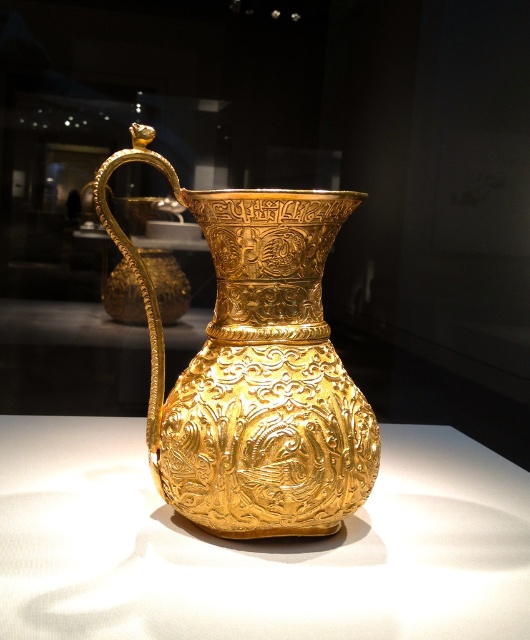
Looking at this image, you are a museum visitor standing in front of the polished gold vase at center. The museum requires visitors to maintain a minimum distance of 30 inches from all artifacts for preservation purposes. Are you currently violating this rule?

The polished gold vase at center and viewer are 27.43 inches apart from each other, which is less than the required 30 inches. Therefore, you are violating the museum rule and should step back to maintain the appropriate distance.

From the picture: You are a photographer trying to capture the golden pitcher in the museum. You notice two points on the pitcher labeled as point (46, 632) and point (267, 426). Which point would appear larger in your photo?

Point (46, 632) is closer to the camera than point (267, 426), so it would appear larger in the photo.

You are a security guard in the museum and need to locate the polished gold vase at center. According to the coordinates provided, where should you look to find it?

The polished gold vase at center is located at the coordinates point (257, 547).